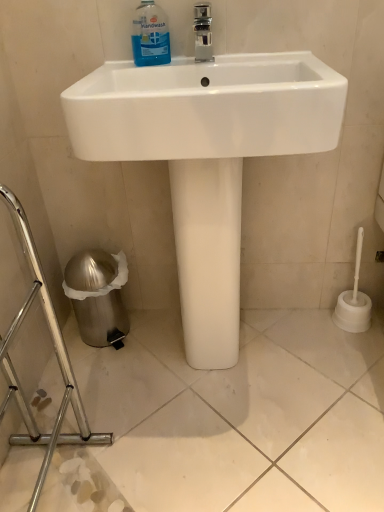
Locate an element on the screen. The width and height of the screenshot is (384, 512). blue translucent liquid at upper center is located at coordinates (150, 35).

The width and height of the screenshot is (384, 512). What do you see at coordinates (57, 359) in the screenshot?
I see `silver metallic trash can at lower left` at bounding box center [57, 359].

You are a GUI agent. You are given a task and a screenshot of the screen. Output one action in this format:
    pyautogui.click(x=<x>, y=<y>)
    Task: Click on the white glossy sink at center
    Image resolution: width=384 pixels, height=512 pixels.
    Given the screenshot: What is the action you would take?
    pyautogui.click(x=207, y=157)

In terms of size, does silver metallic trash can at lower left appear bigger or smaller than blue translucent liquid at upper center?

silver metallic trash can at lower left is bigger than blue translucent liquid at upper center.

Is silver metallic trash can at lower left at the right side of blue translucent liquid at upper center?

Incorrect, silver metallic trash can at lower left is not on the right side of blue translucent liquid at upper center.

How distant is silver metallic trash can at lower left from blue translucent liquid at upper center?

silver metallic trash can at lower left is 28.53 inches away from blue translucent liquid at upper center.

From the image's perspective, is silver metallic trash can at lower left on top of blue translucent liquid at upper center?

No, from the image's perspective, silver metallic trash can at lower left is not on top of blue translucent liquid at upper center.

From the image's perspective, between blue translucent liquid at upper center and white glossy sink at center, who is located below?

white glossy sink at center is shown below in the image.

Is blue translucent liquid at upper center bigger or smaller than white glossy sink at center?

Considering their sizes, blue translucent liquid at upper center takes up less space than white glossy sink at center.

Can you confirm if blue translucent liquid at upper center is taller than white glossy sink at center?

Incorrect, the height of blue translucent liquid at upper center is not larger of that of white glossy sink at center.

Is blue translucent liquid at upper center oriented towards white glossy sink at center?

Yes, blue translucent liquid at upper center is aimed at white glossy sink at center.

From a real-world perspective, is white glossy sink at center on top of silver metallic trash can at lower left?

Yes, from a real-world perspective, white glossy sink at center is above silver metallic trash can at lower left.

Is point (172, 90) closer to camera compared to point (5, 352)?

That is True.

Is white glossy sink at center inside or outside of silver metallic trash can at lower left?

white glossy sink at center is not enclosed by silver metallic trash can at lower left.

Is white glossy sink at center in contact with silver metallic trash can at lower left?

No, white glossy sink at center is not in contact with silver metallic trash can at lower left.

From the image's perspective, between white glossy sink at center and blue translucent liquid at upper center, who is located below?

From the image's view, white glossy sink at center is below.

From a real-world perspective, is white glossy sink at center beneath blue translucent liquid at upper center?

Yes.

Considering the relative positions of white glossy sink at center and blue translucent liquid at upper center in the image provided, is white glossy sink at center to the left or to the right of blue translucent liquid at upper center?

From the image, it's evident that white glossy sink at center is to the right of blue translucent liquid at upper center.

The image size is (384, 512). In order to click on sink behind the silver metallic trash can at lower left in this screenshot , I will do `click(207, 157)`.

From their relative heights in the image, would you say silver metallic trash can at lower left is taller or shorter than white glossy sink at center?

Considering their sizes, silver metallic trash can at lower left has less height than white glossy sink at center.

How many degrees apart are the facing directions of silver metallic trash can at lower left and white glossy sink at center?

The angular difference between silver metallic trash can at lower left and white glossy sink at center is 92.3 degrees.

Does silver metallic trash can at lower left come in front of white glossy sink at center?

Yes.

Considering the sizes of objects blue translucent liquid at upper center and silver metallic trash can at lower left in the image provided, who is wider, blue translucent liquid at upper center or silver metallic trash can at lower left?

silver metallic trash can at lower left.

Is blue translucent liquid at upper center facing away from silver metallic trash can at lower left?

blue translucent liquid at upper center is not turned away from silver metallic trash can at lower left.

I want to click on cleaning product on the right of the silver metallic trash can at lower left, so click(150, 35).

Who is more distant, blue translucent liquid at upper center or silver metallic trash can at lower left?

Positioned behind is blue translucent liquid at upper center.

Find the location of a particular element. The image size is (384, 512). porcelain to the left of blue translucent liquid at upper center is located at coordinates (57, 359).

This screenshot has width=384, height=512. Find the location of `cleaning product that appears above the white glossy sink at center (from the image's perspective)`. cleaning product that appears above the white glossy sink at center (from the image's perspective) is located at coordinates (150, 35).

Looking at the image, which one is located further to white glossy sink at center, blue translucent liquid at upper center or silver metallic trash can at lower left?

silver metallic trash can at lower left lies further to white glossy sink at center than the other object.

From the image, which object appears to be farther from silver metallic trash can at lower left, white glossy sink at center or blue translucent liquid at upper center?

Among the two, blue translucent liquid at upper center is located further to silver metallic trash can at lower left.

Which object lies nearer to the anchor point blue translucent liquid at upper center, silver metallic trash can at lower left or white glossy sink at center?

white glossy sink at center is positioned closer to the anchor blue translucent liquid at upper center.

Based on the photo, estimate the real-world distances between objects in this image. Which object is further from silver metallic trash can at lower left, blue translucent liquid at upper center or white glossy sink at center?

blue translucent liquid at upper center lies further to silver metallic trash can at lower left than the other object.

Considering their positions, is silver metallic trash can at lower left positioned closer to white glossy sink at center than blue translucent liquid at upper center?

blue translucent liquid at upper center is positioned closer to the anchor white glossy sink at center.

Which object lies further to the anchor point blue translucent liquid at upper center, white glossy sink at center or silver metallic trash can at lower left?

silver metallic trash can at lower left is further to blue translucent liquid at upper center.

The image size is (384, 512). In order to click on sink between blue translucent liquid at upper center and silver metallic trash can at lower left in the up-down direction in this screenshot , I will do pyautogui.click(x=207, y=157).